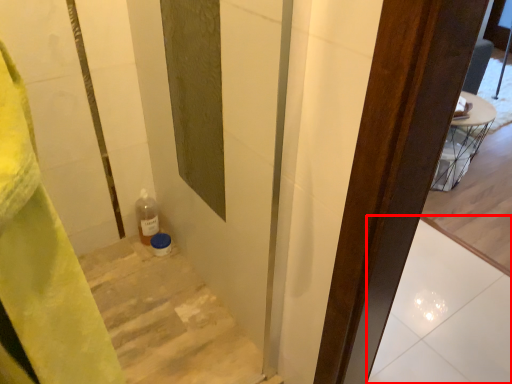
Question: From the image's perspective, what is the correct spatial relationship of tile (annotated by the red box) in relation to stairs?

Choices:
 (A) above
 (B) below

Answer: (A)